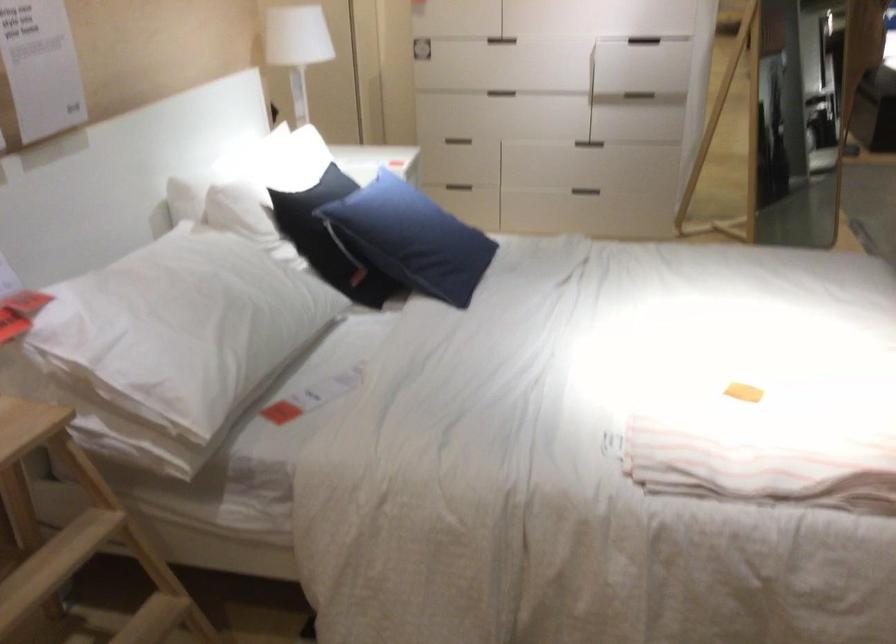
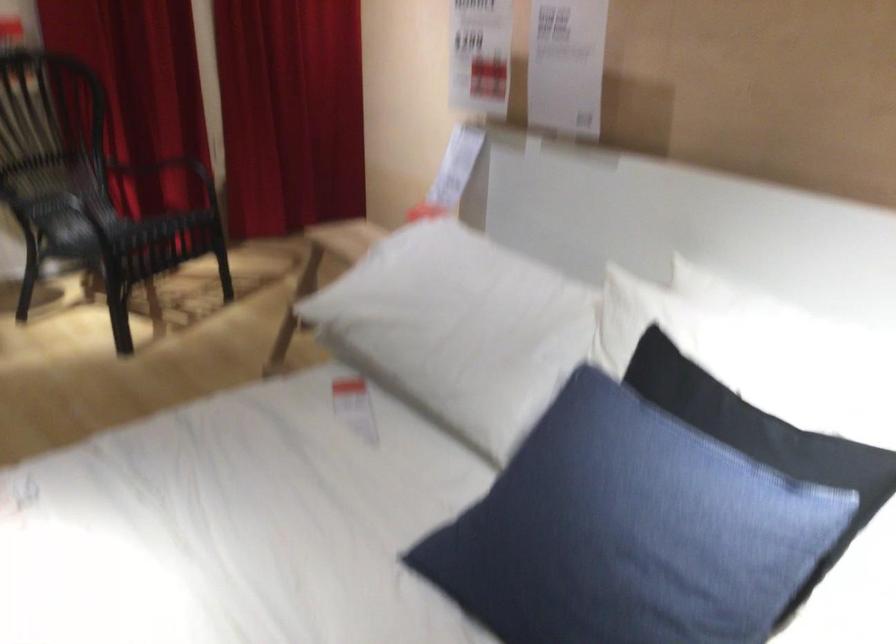
Locate, in the second image, the point that corresponds to the point at 226,308 in the first image.

(455, 321)